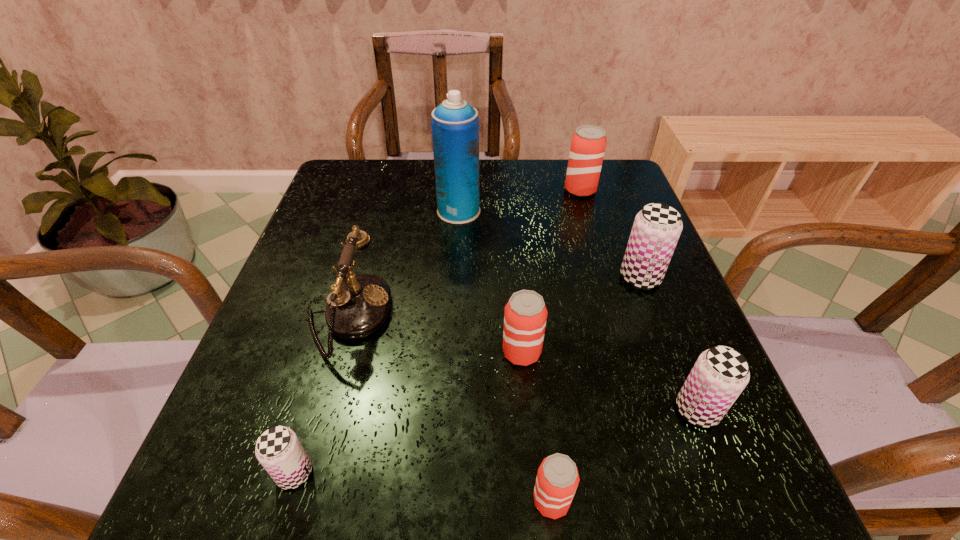
Where is `free space between the fourth nearest beer can and the fourth farthest beer can`? The width and height of the screenshot is (960, 540). free space between the fourth nearest beer can and the fourth farthest beer can is located at coordinates (610, 381).

Locate an element on the screen. Image resolution: width=960 pixels, height=540 pixels. free spot between the fifth nearest beer can and the smallest orange beer can is located at coordinates (596, 389).

Find the location of `object that stands as the third closest to the black telephone`. object that stands as the third closest to the black telephone is located at coordinates [x=525, y=316].

Identify which object is the sixth closest to the leftmost purple beer can. Please provide its 2D coordinates. Your answer should be formatted as a tuple, i.e. [(x, y)], where the tuple contains the x and y coordinates of a point satisfying the conditions above.

[(657, 227)]

Find the location of a particular element. The height and width of the screenshot is (540, 960). the closest beer can to the second farthest orange beer can is located at coordinates (557, 479).

Select which beer can appears as the fifth closest to the telephone. Please provide its 2D coordinates. Your answer should be formatted as a tuple, i.e. [(x, y)], where the tuple contains the x and y coordinates of a point satisfying the conditions above.

[(588, 143)]

Identify which orange beer can is located as the nearest to the telephone. Please provide its 2D coordinates. Your answer should be formatted as a tuple, i.e. [(x, y)], where the tuple contains the x and y coordinates of a point satisfying the conditions above.

[(525, 316)]

Point out which orange beer can is positioned as the nearest to the tallest object. Please provide its 2D coordinates. Your answer should be formatted as a tuple, i.e. [(x, y)], where the tuple contains the x and y coordinates of a point satisfying the conditions above.

[(588, 143)]

This screenshot has width=960, height=540. I want to click on purple beer can that is the second closest to the third farthest beer can, so click(x=657, y=227).

Identify which purple beer can is the third nearest to the telephone. Please provide its 2D coordinates. Your answer should be formatted as a tuple, i.e. [(x, y)], where the tuple contains the x and y coordinates of a point satisfying the conditions above.

[(720, 374)]